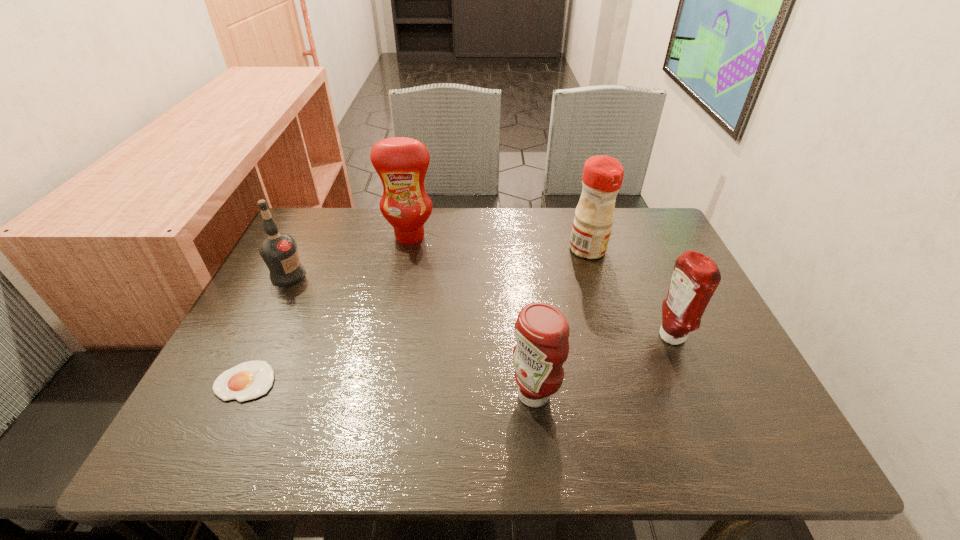
The height and width of the screenshot is (540, 960). Find the location of `free space between the third object from left to right and the second condiment from right to left`. free space between the third object from left to right and the second condiment from right to left is located at coordinates (499, 243).

I want to click on vacant space in between the second condiment from right to left and the egg yolk, so click(417, 315).

Identify the location of object that is the fourth closest to the third object from right to left. (249, 380).

The width and height of the screenshot is (960, 540). I want to click on object that stands as the second closest to the rightmost object, so click(x=541, y=331).

Where is `condiment that can be found as the third closest to the fourth object from right to left`? This screenshot has width=960, height=540. condiment that can be found as the third closest to the fourth object from right to left is located at coordinates (695, 277).

Choose which condiment is the nearest neighbor to the third object from left to right. Please provide its 2D coordinates. Your answer should be formatted as a tuple, i.e. [(x, y)], where the tuple contains the x and y coordinates of a point satisfying the conditions above.

[(602, 177)]

This screenshot has height=540, width=960. Identify the location of vacant point that satisfies the following two spatial constraints: 1. on the front label of the third farthest object; 2. on the right side of the egg yolk. pyautogui.click(x=234, y=381).

Identify the location of vacant area that satisfies the following two spatial constraints: 1. on the back side of the nearest condiment; 2. on the front label of the fourth nearest object. (521, 275).

In order to click on vacant space that satisfies the following two spatial constraints: 1. on the back side of the shortest object; 2. on the front label of the third farthest object in this screenshot , I will do `click(297, 275)`.

You are a GUI agent. You are given a task and a screenshot of the screen. Output one action in this format:
    pyautogui.click(x=<x>, y=<y>)
    Task: Click on the free spot that satisfies the following two spatial constraints: 1. on the front label of the vodka; 2. on the left side of the third object from right to left
    The width and height of the screenshot is (960, 540).
    Given the screenshot: What is the action you would take?
    pyautogui.click(x=228, y=395)